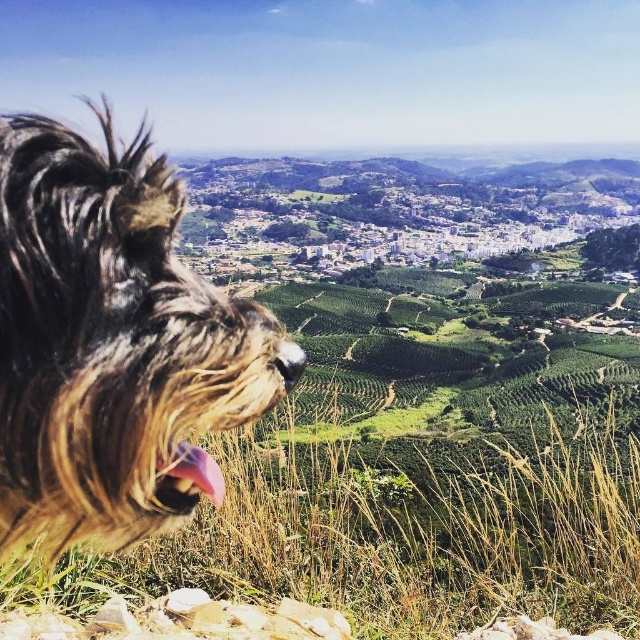
Is point (45, 278) positioned after point (205, 477)?

No, it is not.

Can you confirm if fuzzy brown dog at left is thinner than pink fur at lower left?

Incorrect, fuzzy brown dog at left's width is not less than pink fur at lower left's.

Locate an element on the screen. This screenshot has width=640, height=640. fuzzy brown dog at left is located at coordinates (109, 339).